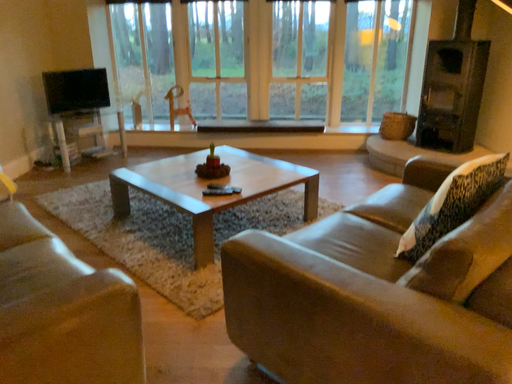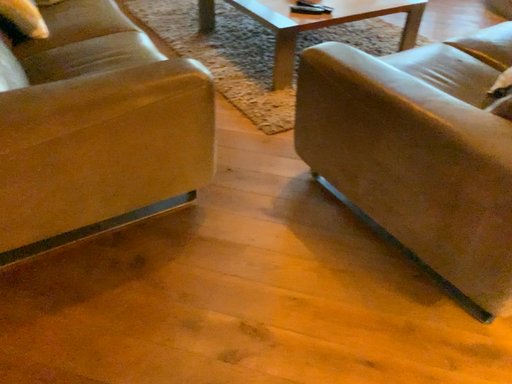
Question: How did the camera likely rotate when shooting the video?

Choices:
 (A) rotated downward
 (B) rotated upward

Answer: (A)